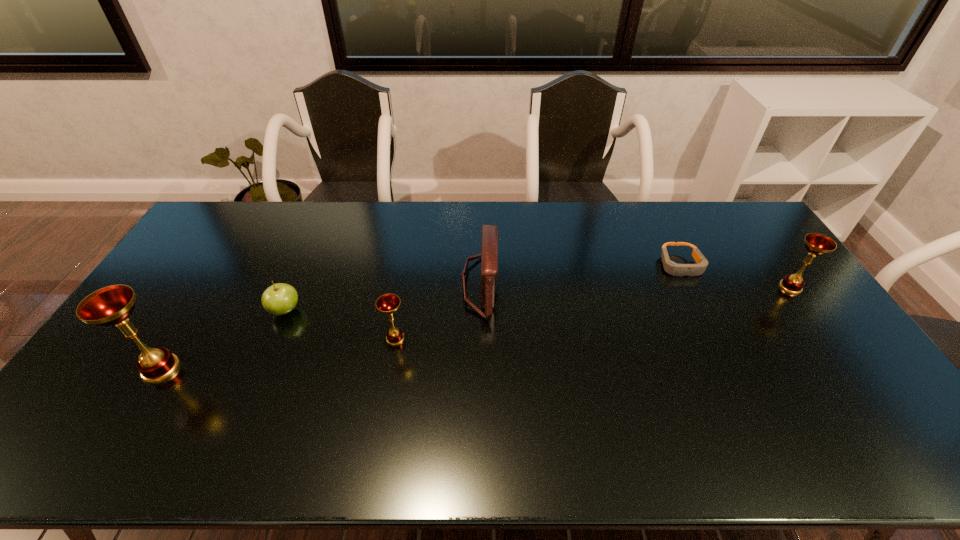
This screenshot has width=960, height=540. I want to click on the fifth object from right to left, so click(x=279, y=299).

Identify the location of free space located on the back of the leftmost chalice. Image resolution: width=960 pixels, height=540 pixels. (230, 256).

Identify the location of vacant space situated on the back of the second farthest chalice. This screenshot has height=540, width=960. (406, 279).

What are the coordinates of `vacant position located 0.400m on the front of the rightmost chalice` in the screenshot? It's located at (880, 414).

The height and width of the screenshot is (540, 960). In order to click on blank area located 0.320m on the front and back of the shortest object in this screenshot , I will do `click(729, 364)`.

At what (x,y) coordinates should I click in order to perform the action: click on vacant space located 0.280m on the front flap of the fourth object from left to right. Please return your answer as a coordinate pair (x, y). This screenshot has height=540, width=960. Looking at the image, I should click on (585, 284).

The image size is (960, 540). I want to click on free location located 0.240m on the front of the second object from left to right, so click(x=249, y=396).

I want to click on object situated at the near edge, so tap(112, 305).

The height and width of the screenshot is (540, 960). I want to click on object positioned at the left edge, so click(112, 305).

Where is `object that is at the right edge`? The image size is (960, 540). object that is at the right edge is located at coordinates tap(816, 244).